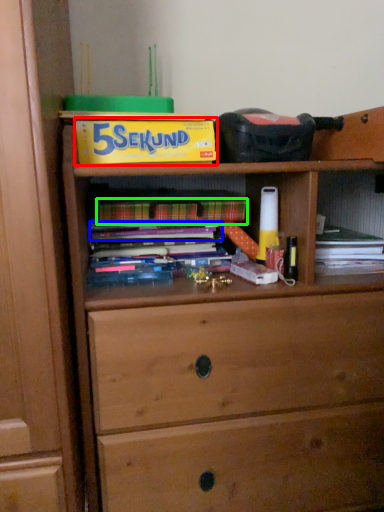
Question: Based on their relative distances, which object is nearer to paperback book (highlighted by a red box)? Choose from book (highlighted by a blue box) and paperback book (highlighted by a green box).

Choices:
 (A) book
 (B) paperback book

Answer: (B)